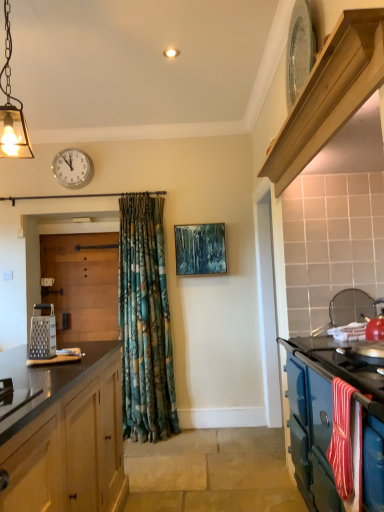
Question: Does point (339, 75) appear closer or farther from the camera than point (324, 406)?

Choices:
 (A) farther
 (B) closer

Answer: (B)

Question: Is light wood/texture shelf at upper right wider or thinner than blue enamel stove at right?

Choices:
 (A) wide
 (B) thin

Answer: (B)

Question: Estimate the real-world distances between objects in this image. Which object is closer to the light wood/texture shelf at upper right?

Choices:
 (A) wooden door at left
 (B) blue enamel stove at right
 (C) textured blue painting at center
 (D) metallic grater at left
 (E) white glossy clock at upper center

Answer: (B)

Question: Which object is the farthest from the wooden door at left?

Choices:
 (A) blue enamel stove at right
 (B) metallic grater at left
 (C) textured blue painting at center
 (D) light wood/texture shelf at upper right
 (E) matte glass pendant light at upper left

Answer: (D)